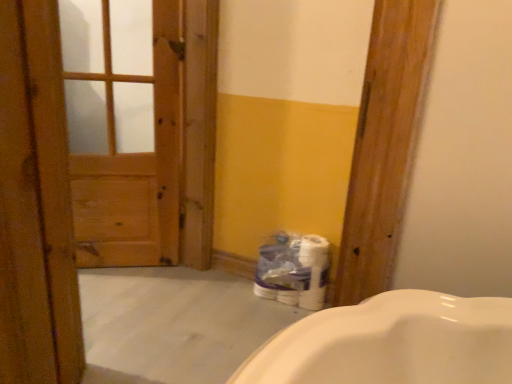
You are a GUI agent. You are given a task and a screenshot of the screen. Output one action in this format:
    pyautogui.click(x=<x>, y=<y>)
    Task: Click on the free space in front of wooden door at left
    The image size is (512, 384).
    Given the screenshot: What is the action you would take?
    pyautogui.click(x=137, y=345)